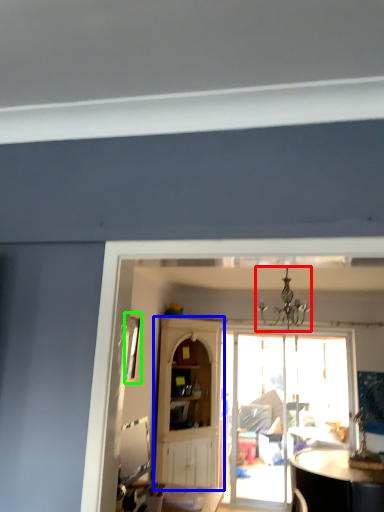
Question: Which is nearer to the light fixture (highlighted by a red box)? cabinetry (highlighted by a blue box) or window (highlighted by a green box).

Choices:
 (A) cabinetry
 (B) window

Answer: (B)